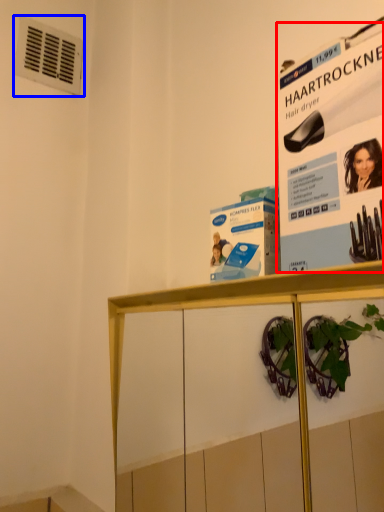
Question: Which of the following is the closest to the observer, poster page (highlighted by a red box) or air conditioning (highlighted by a blue box)?

Choices:
 (A) poster page
 (B) air conditioning

Answer: (A)